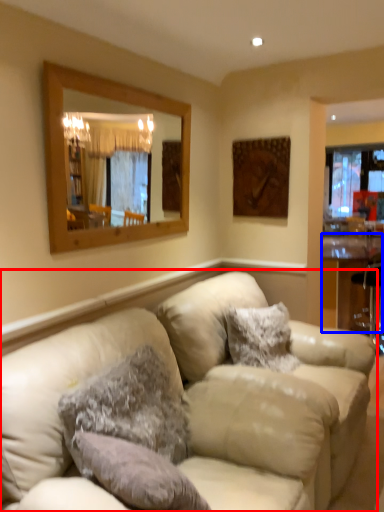
Question: Among these objects, which one is farthest to the camera, studio couch (highlighted by a red box) or table (highlighted by a blue box)?

Choices:
 (A) studio couch
 (B) table

Answer: (B)